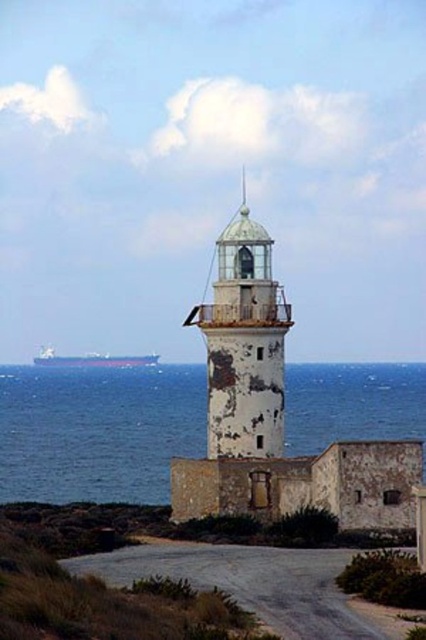
Question: Among these points, which one is nearest to the camera?

Choices:
 (A) (43, 365)
 (B) (328, 374)

Answer: (B)

Question: Does white weathered tower at center have a greater width compared to smooth gray ship at left?

Choices:
 (A) no
 (B) yes

Answer: (A)

Question: Considering the relative positions of white weathered tower at center and smooth gray ship at left in the image provided, where is white weathered tower at center located with respect to smooth gray ship at left?

Choices:
 (A) above
 (B) below

Answer: (A)

Question: Estimate the real-world distances between objects in this image. Which object is farther from the smooth gray ship at left?

Choices:
 (A) blue water at center
 (B) white weathered tower at center

Answer: (B)

Question: Does blue water at center have a larger size compared to white weathered tower at center?

Choices:
 (A) yes
 (B) no

Answer: (A)

Question: Based on their relative distances, which object is farther from the smooth gray ship at left?

Choices:
 (A) white weathered tower at center
 (B) blue water at center

Answer: (A)